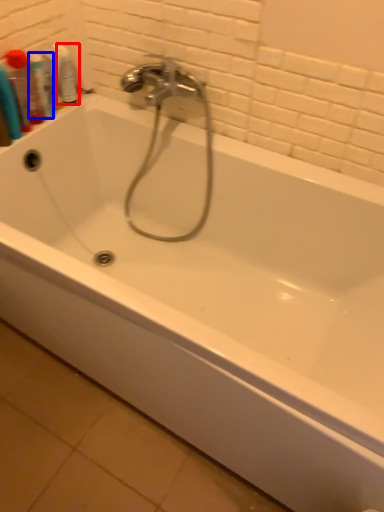
Question: Which point is closer to the camera, mouthwash (highlighted by a red box) or mouthwash (highlighted by a blue box)?

Choices:
 (A) mouthwash
 (B) mouthwash

Answer: (B)